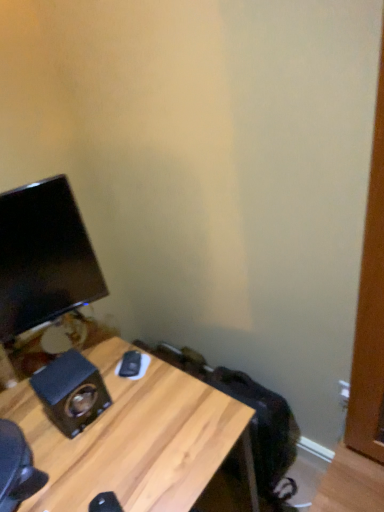
This screenshot has height=512, width=384. Identify the location of free point in front of wooden grain speaker at lower left. (89, 463).